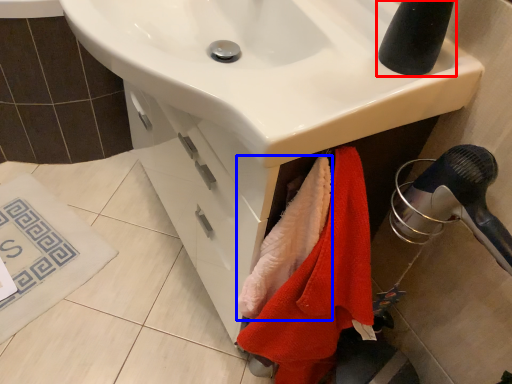
Question: Which object appears farthest to the camera in this image, tap (highlighted by a red box) or beach towel (highlighted by a blue box)?

Choices:
 (A) tap
 (B) beach towel

Answer: (B)